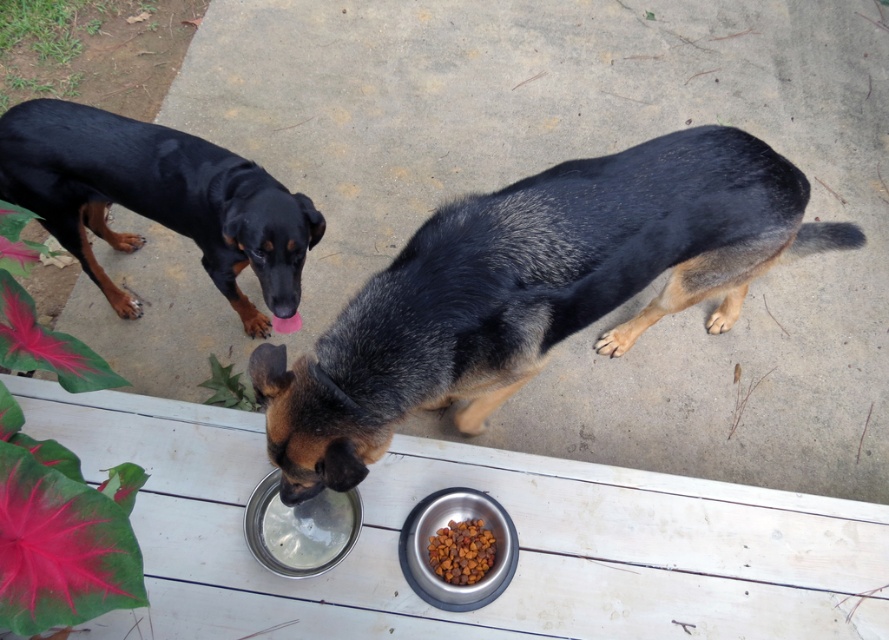
You are a dog owner who wants to ensure your pets are comfortable. Looking at the image, where is the black glossy fur at upper left in relation to the dry kibble at lower center?

The black glossy fur at upper left is positioned to the left of the dry kibble at lower center.

You are a dog owner who wants to ensure your dogs have easy access to their food and water. Based on the scene, how far apart are the black glossy fur at upper left and dry kibble at lower center?

The black glossy fur at upper left is 95.71 centimeters away from the dry kibble at lower center. This distance may be too far for the dogs to comfortably reach both their food and water bowls easily.

You are a dog owner who wants to ensure both dogs have enough space to drink water. The black fur dog at center and the black glossy fur at upper left are both near their respective bowls. Which dog requires a wider space around its bowl to accommodate its size?

The black fur dog at center requires a wider space around its bowl because its width is larger than the black glossy fur at upper left.